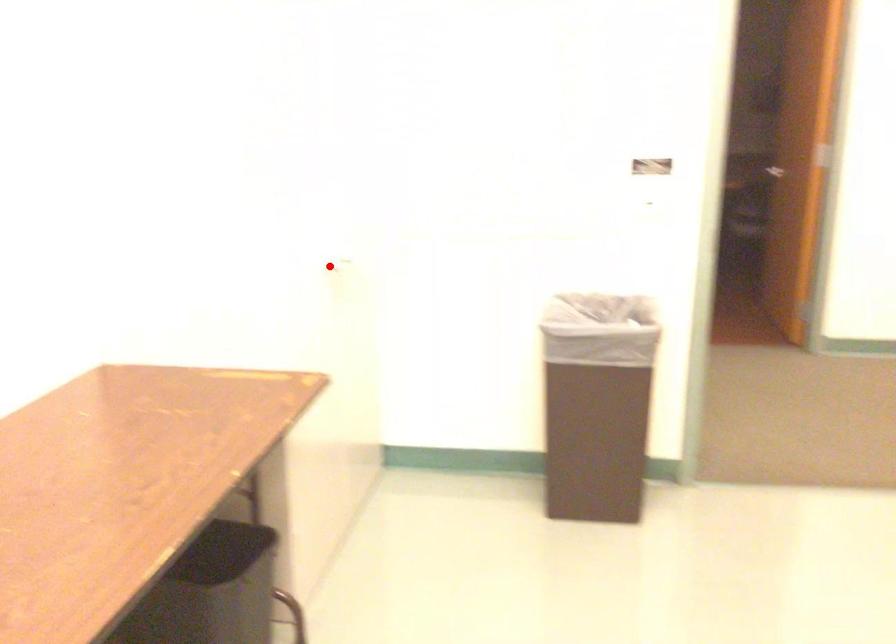
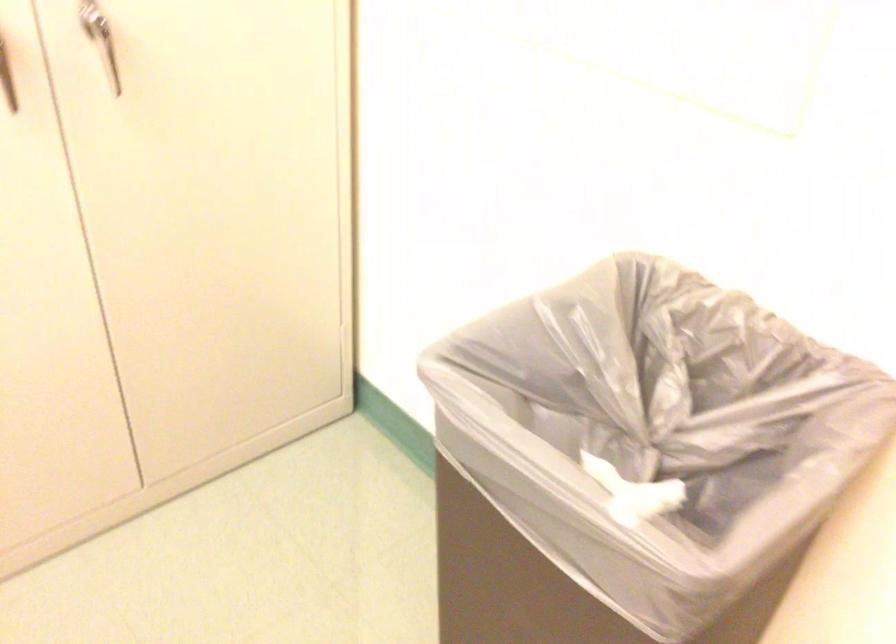
Where in the second image is the point corresponding to the highlighted location from the first image?

(106, 51)